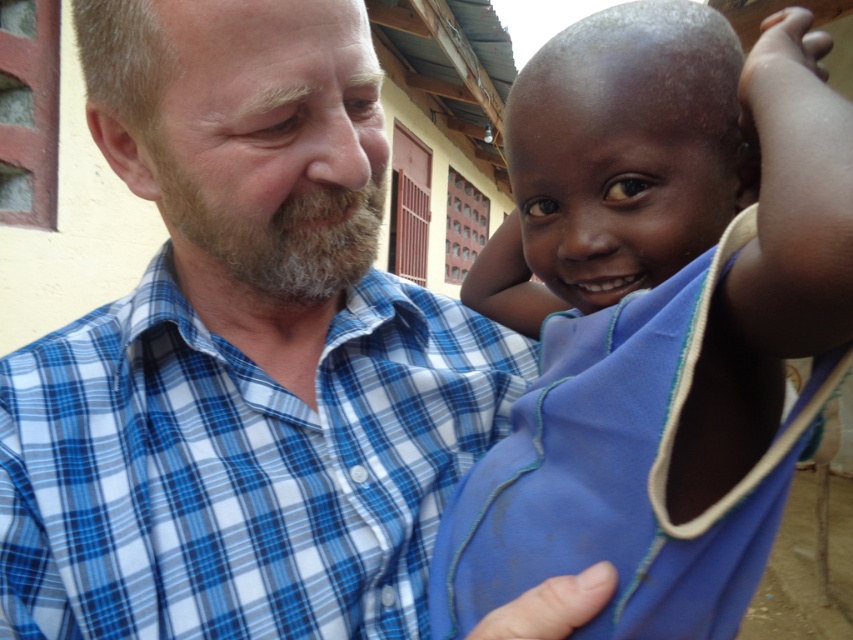
Who is higher up, blue fabric at right or blue plaid shirt at center?

blue fabric at right is higher up.

Is blue fabric at right positioned behind blue plaid shirt at center?

No, it is in front of blue plaid shirt at center.

Is point (712, 388) closer to camera compared to point (131, 627)?

That is True.

Identify the location of blue fabric at right. The image size is (853, 640). (656, 316).